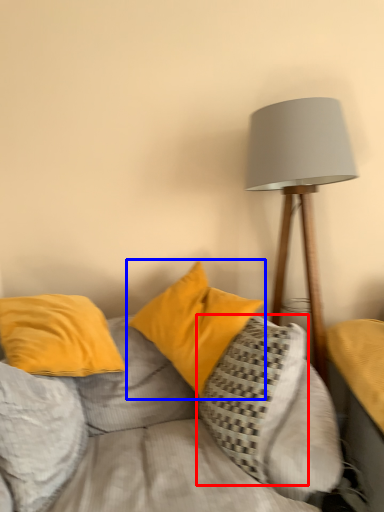
Question: Which object appears closest to the camera in this image, pillow (highlighted by a red box) or pillow (highlighted by a blue box)?

Choices:
 (A) pillow
 (B) pillow

Answer: (A)